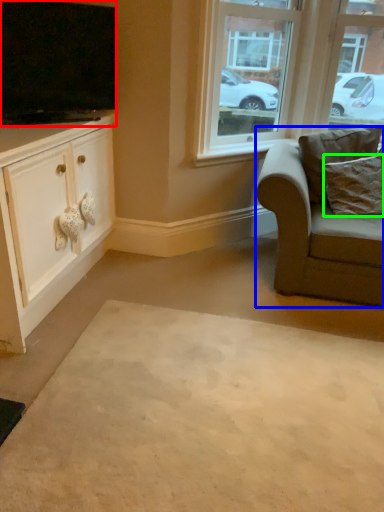
Question: Which object is positioned closest to television (highlighted by a red box)? Select from chair (highlighted by a blue box) and pillow (highlighted by a green box).

Choices:
 (A) chair
 (B) pillow

Answer: (A)